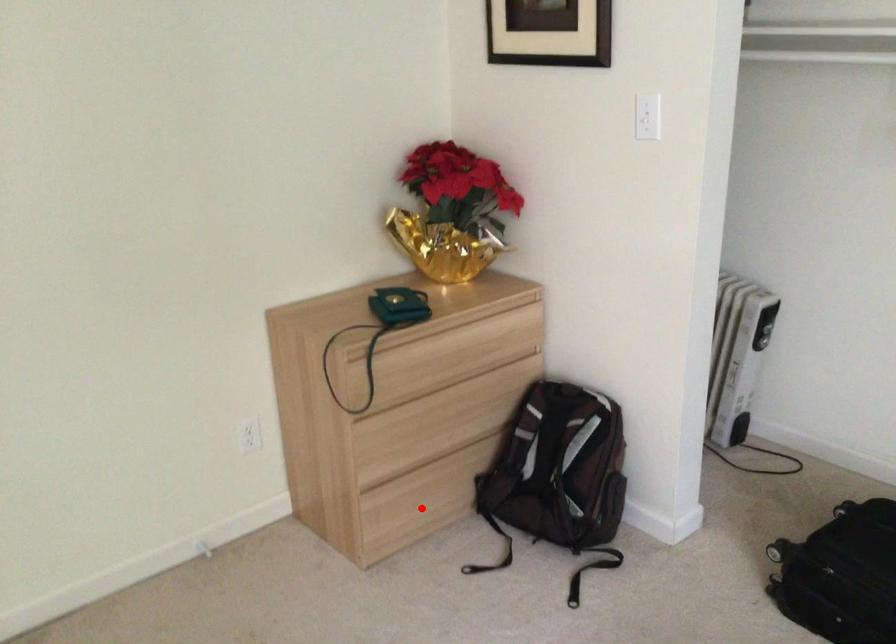
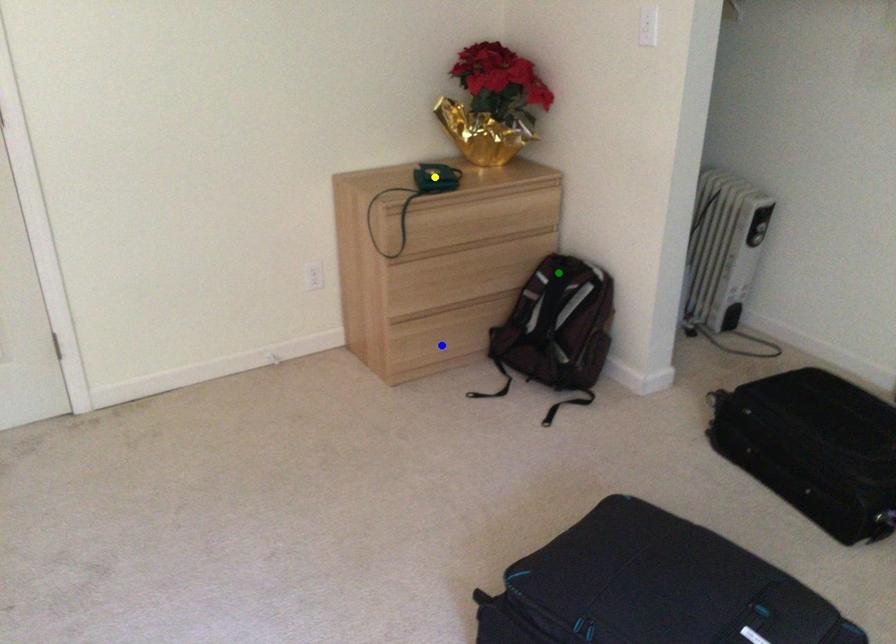
Question: I am providing you with two images of the same scene from different viewpoints. A red point is marked on the first image. You are given multiple points on the second image. Can you choose the point in image 2 that corresponds to the point in image 1?

Choices:
 (A) blue point
 (B) yellow point
 (C) green point

Answer: (A)